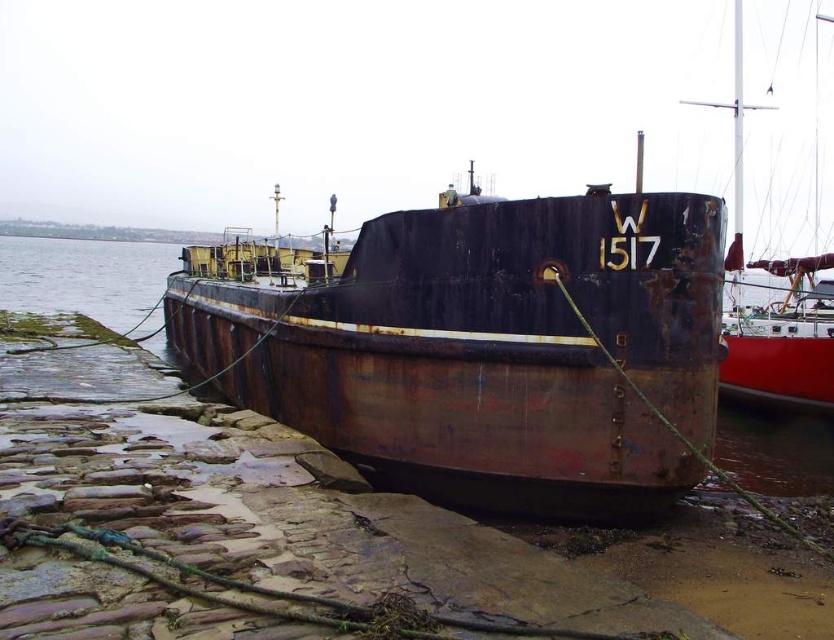
You are standing on the pier and see the point marked at coordinates (488, 349). What object is located at that point?

The point at coordinates (488, 349) marks the rusty metal boat at center.

You are standing at the stone pier looking at the barge. There are two points marked on the barge. Which point is closer to you, point (521, 384) or point (797, 390)?

Point (521, 384) is in front of point (797, 390), so it is closer to you.

You are standing on the pier and see the rusty metal boat at center and the rusty metal boat at right. Which boat is closer to the water surface?

The rusty metal boat at center is positioned under the rusty metal boat at right, so the rusty metal boat at center is closer to the water surface.